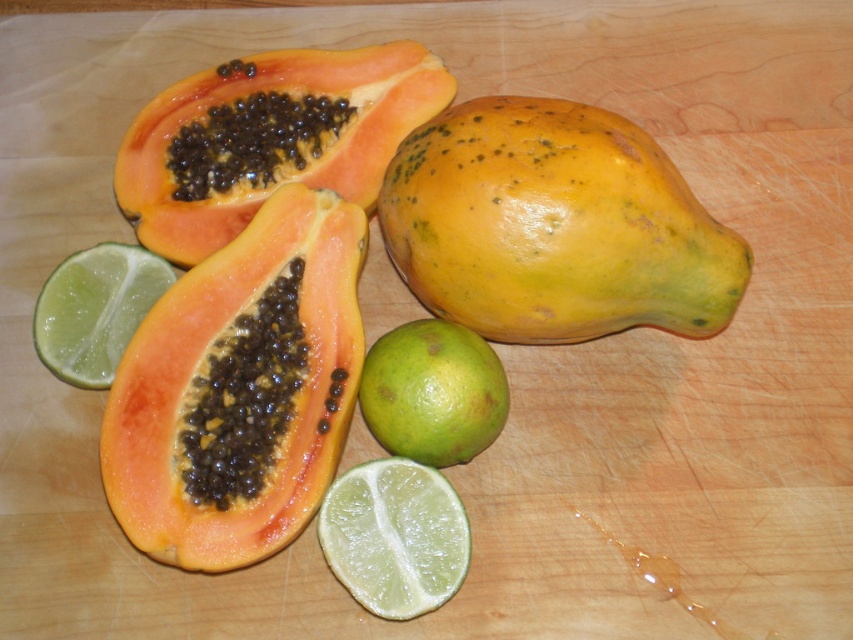
Question: Can you confirm if orange matte papaya at center is wider than orange matte papaya at upper left?

Choices:
 (A) no
 (B) yes

Answer: (A)

Question: Estimate the real-world distances between objects in this image. Which object is closer to the orange matte papaya at center?

Choices:
 (A) yellow matte papaya at center
 (B) green matte lemon at lower left
 (C) green matte lemon at lower center
 (D) orange matte papaya at upper left

Answer: (B)

Question: Among these points, which one is nearest to the camera?

Choices:
 (A) (146, 353)
 (B) (33, 340)
 (C) (436, 413)
 (D) (409, 241)

Answer: (A)

Question: Is yellow matte papaya at center behind green matte lemon at lower center?

Choices:
 (A) yes
 (B) no

Answer: (A)

Question: Estimate the real-world distances between objects in this image. Which object is closer to the orange matte papaya at center?

Choices:
 (A) yellow matte papaya at center
 (B) green matte lime at center
 (C) green matte lemon at lower left
 (D) orange matte papaya at upper left

Answer: (B)

Question: Where is orange matte papaya at center located in relation to green matte lemon at lower left in the image?

Choices:
 (A) right
 (B) left

Answer: (A)